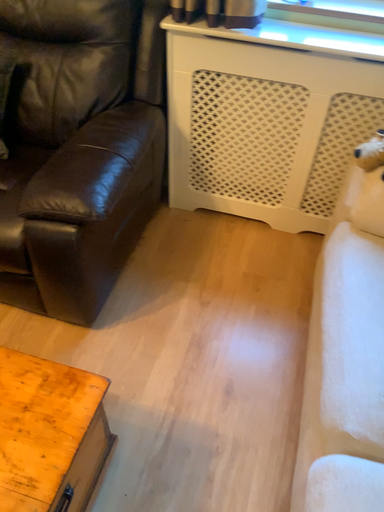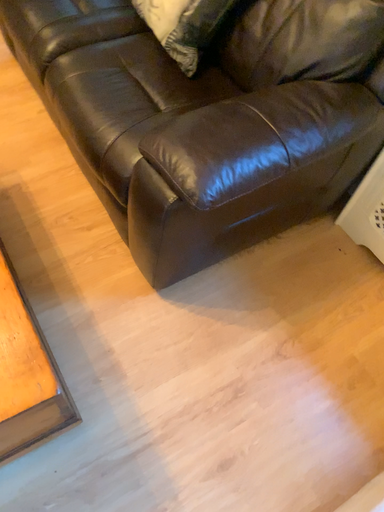
Question: Which way did the camera rotate in the video?

Choices:
 (A) rotated left
 (B) rotated right

Answer: (A)